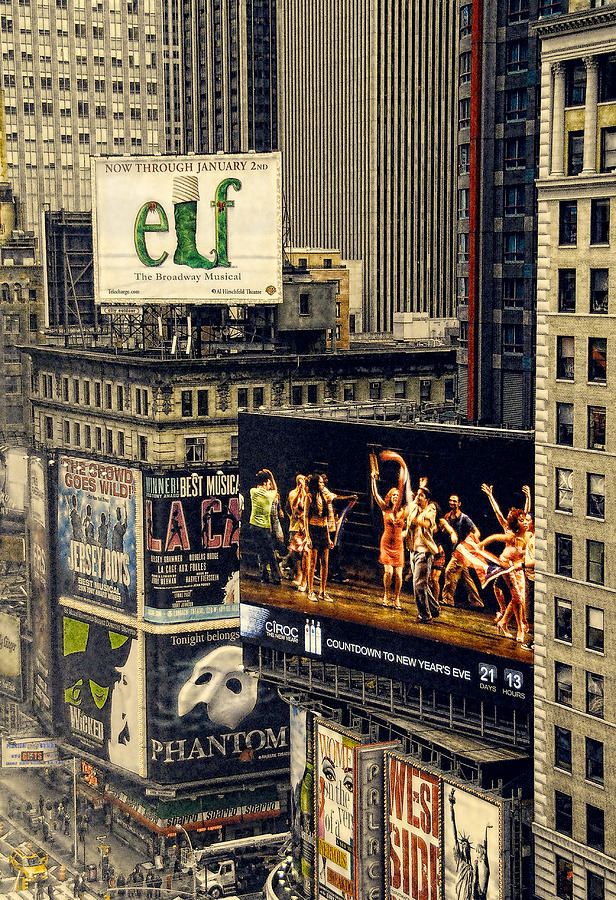
Where is `wicked poster`? The image size is (616, 900). wicked poster is located at coordinates (95, 664).